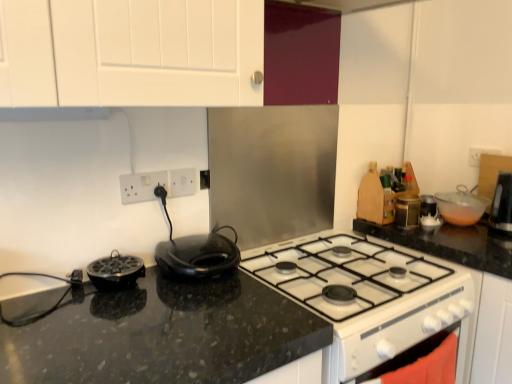
Question: Considering the positions of black granite countertop at center and white plastic electrical outlet at center-left, the first electric outlet positioned from the left, in the image, is black granite countertop at center bigger or smaller than white plastic electrical outlet at center-left, the first electric outlet positioned from the left,?

Choices:
 (A) big
 (B) small

Answer: (A)

Question: In terms of height, does black granite countertop at center look taller or shorter compared to white plastic electrical outlet at center-left, the first electric outlet positioned from the left?

Choices:
 (A) tall
 (B) short

Answer: (A)

Question: Based on their relative distances, which object is farther from the white glossy exhaust hood at upper center?

Choices:
 (A) black plastic toaster at center, which is the second kitchen appliance from front to back
 (B) transparent plastic bowl at upper right, which appears as the 3th kitchen appliance when viewed from the front
 (C) white frosted glass jar at upper right
 (D) white plastic electric outlet at upper center, the 2th electric outlet viewed from the left
 (E) black granite countertop at center

Answer: (B)

Question: Which object is positioned farthest from the white glossy exhaust hood at upper center?

Choices:
 (A) transparent plastic bowl at upper right, which appears as the 3th kitchen appliance when viewed from the front
 (B) white frosted glass jar at upper right
 (C) white glossy oven at lower right
 (D) black plastic toaster at center, positioned as the second kitchen appliance in left-to-right order
 (E) white plastic electric outlet at upper center, the 2th electric outlet viewed from the left

Answer: (A)